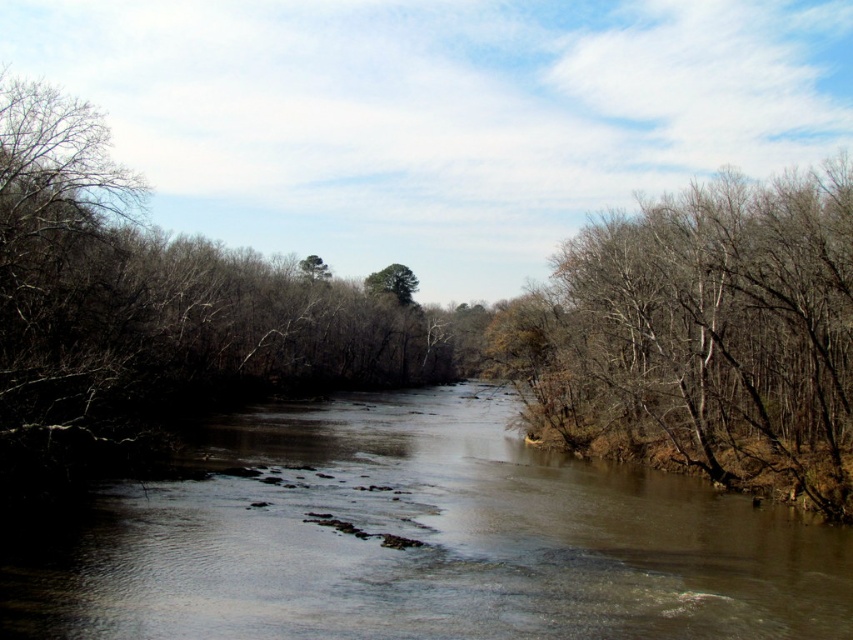
You are an ornithologist observing the river scene. You need to determine which tree is better for nesting birds based on height. Which tree between the brown leafless tree at right and the green leafy tree at center is taller?

The brown leafless tree at right is taller than the green leafy tree at center, so it would be better for nesting birds seeking higher elevation.

You are standing at a point 114.46 feet away from the camera. You want to cross the river. The river has rocks and submerged logs near the center. Can you safely walk from your current position to the point marked at coordinates point [817,388]?

The point [817,388] is 114.46 feet away from the camera. Since you are standing at a point 114.46 feet away from the camera, you are at the same location as the point marked at coordinates point [817,388]. Therefore, you are already at the desired point and do not need to cross the river.

You are standing on the riverbank and want to cross the river using the path that goes through the brown muddy water at center and the brown leafless tree at right. Which object should you avoid stepping on to stay on the path?

You should avoid stepping on the brown leafless tree at right because the path goes through the brown muddy water at center to the left of it.